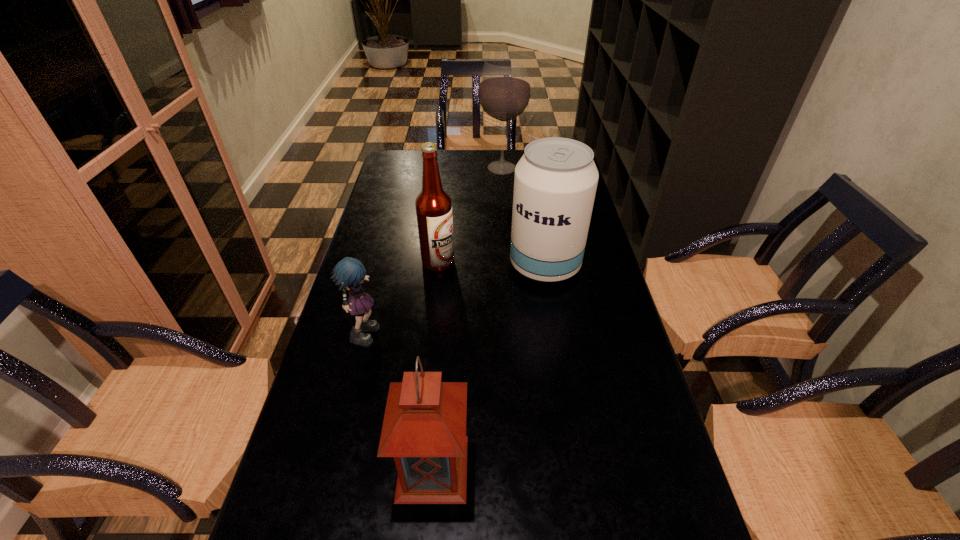
Find the location of a particular element. This screenshot has width=960, height=540. object at the left edge is located at coordinates (349, 273).

Where is `object present at the right edge`? Image resolution: width=960 pixels, height=540 pixels. object present at the right edge is located at coordinates (555, 182).

Where is `free space at the left edge of the desktop`? free space at the left edge of the desktop is located at coordinates (408, 204).

The image size is (960, 540). I want to click on vacant space at the right edge, so click(598, 399).

This screenshot has width=960, height=540. Find the location of `free point at the far left corner`. free point at the far left corner is located at coordinates (393, 170).

At what (x,y) coordinates should I click in order to perform the action: click on free space between the shortest object and the leftmost alcohol. Please return your answer as a coordinate pair (x, y). Looking at the image, I should click on (402, 296).

Find the location of `free space that is in between the farthest alcohol and the leftmost alcohol`. free space that is in between the farthest alcohol and the leftmost alcohol is located at coordinates (470, 215).

Locate an element on the screen. free space between the farthest object and the lantern is located at coordinates coord(468,318).

The width and height of the screenshot is (960, 540). I want to click on vacant area between the leftmost alcohol and the lantern, so click(436, 365).

Find the location of a particular element. free spot between the leftmost alcohol and the leftmost object is located at coordinates (402, 296).